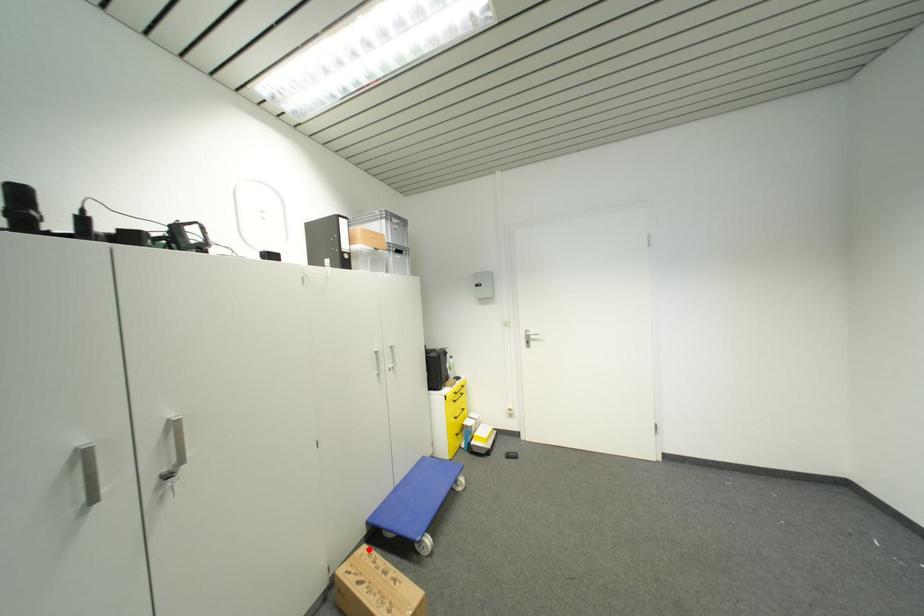
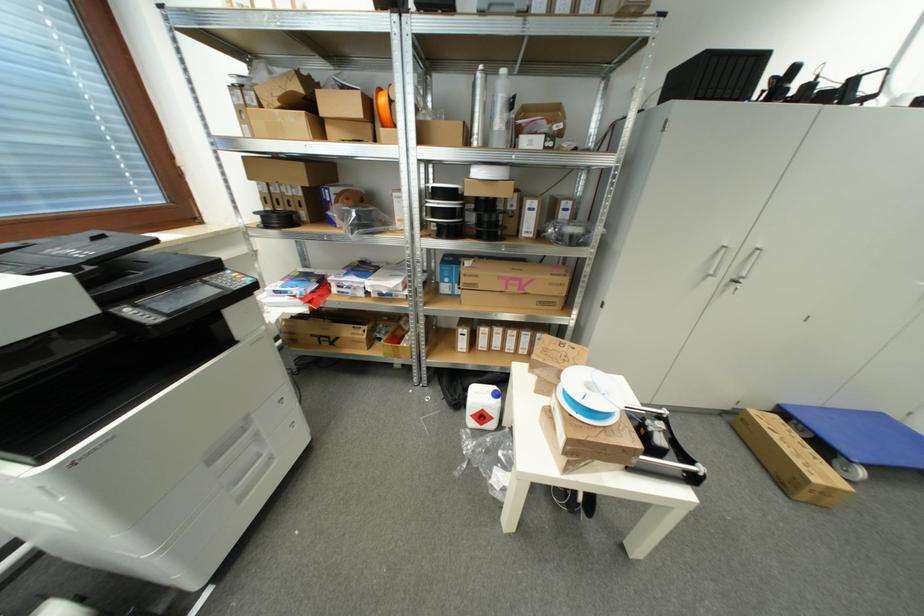
Question: I am providing you with two images of the same scene from different viewpoints. Given a red point in image1, look at the same physical point in image2. Is it:

Choices:
 (A) Closer to the viewpoint
 (B) Farther from the viewpoint

Answer: (A)